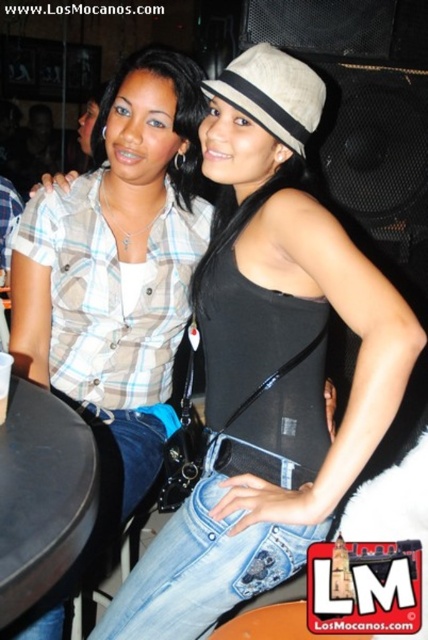
You are a photographer trying to capture a candid shot of the two people in the image. The denim jeans at lower center and the beige fabric hat at center are in your frame. To ensure the jeans are fully visible, should you adjust your camera angle to focus more on the lower part of the frame?

The denim jeans at lower center might be wider than the beige fabric hat at center, so adjusting the camera angle to focus more on the lower part of the frame would help ensure the jeans are fully visible.

Consider the image. You are at a bar and see two people. The person on the left is wearing a light plaid shirt and blue jeans. The person on the right is wearing a black sleeveless top and light blue jeans with a beige hat. A black camera bag is on their shoulder. There is a point at coordinates (202,568). What is located at that point?

Denim jeans at lower center are located at point (202,568).

You are a photographer at a social event and need to quickly assess the scene. Which object in the image has a larger size between the denim jeans at lower center and the beige fabric hat at center?

The denim jeans at lower center has a larger size compared to the beige fabric hat at center.